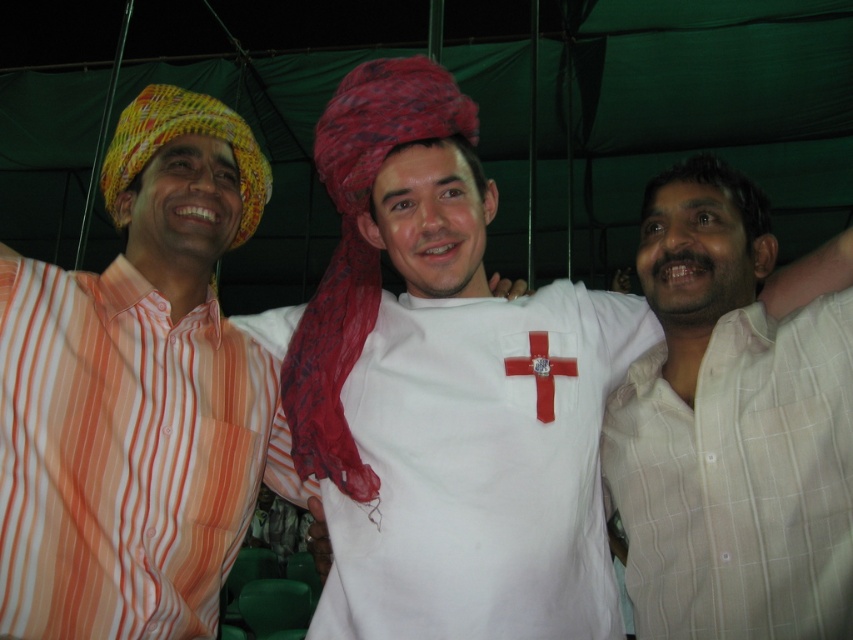
You are standing in front of the image and want to point to the person wearing the white matte shirt at center. What are the coordinates of this person in the image?

The coordinates of the white matte shirt at center are at point (444,392).

You are trying to locate the point at coordinates [740,481] in the image. Which object from the list below is this point located on? Choose from the objects listed below. The objects are the three people and their clothing items. The options are the three people and their clothing items. The options are the three people and their clothing items. The options are the three people and their clothing items. The options are the three people and their clothing items. The options are the three people and their.

The point at coordinates [740,481] is located on the white checkered shirt at right.

You are standing at the point with coordinates point (126, 164) and want to walk towards the point with coordinates point (527, 614). Which direction should you move?

You should move forward because point (527, 614) is in front of point (126, 164).